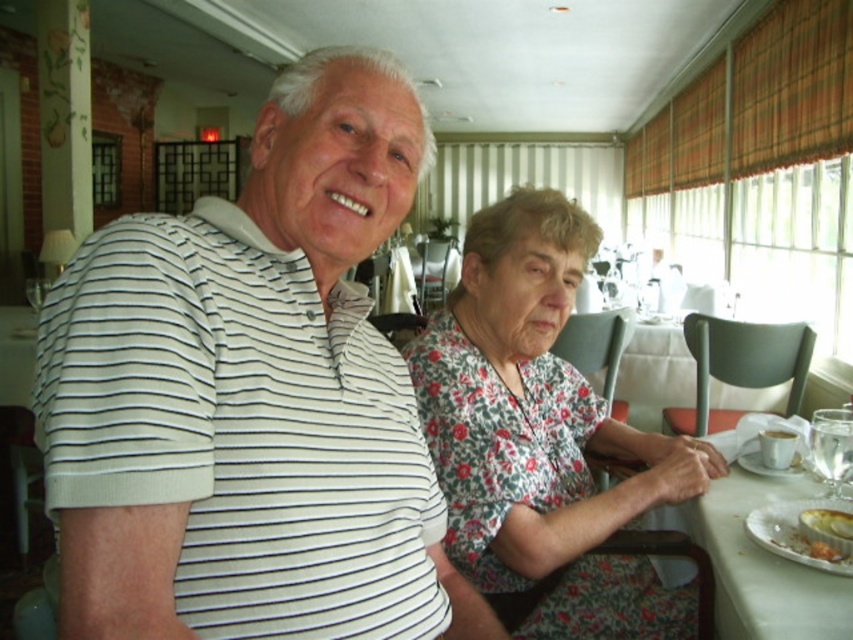
Is point (253, 451) positioned behind point (751, 532)?

No.

Does white striped polo shirt at left have a lesser height compared to white porcelain plate at lower right?

In fact, white striped polo shirt at left may be taller than white porcelain plate at lower right.

Find the location of `white striped polo shirt at left`. white striped polo shirt at left is located at coordinates (251, 397).

Does floral fabric dress at center appear on the left side of white porcelain plate at lower right?

Indeed, floral fabric dress at center is positioned on the left side of white porcelain plate at lower right.

How far apart are floral fabric dress at center and white porcelain plate at lower right?

floral fabric dress at center is 14.32 inches from white porcelain plate at lower right.

Which is in front, point (479, 472) or point (792, 534)?

Point (792, 534) is more forward.

In order to click on floral fabric dress at center in this screenshot , I will do `click(543, 435)`.

The image size is (853, 640). What do you see at coordinates (251, 397) in the screenshot?
I see `white striped polo shirt at left` at bounding box center [251, 397].

Between white striped polo shirt at left and white cloth table at lower right, which one appears on the left side from the viewer's perspective?

white striped polo shirt at left is more to the left.

Image resolution: width=853 pixels, height=640 pixels. What do you see at coordinates (251, 397) in the screenshot? I see `white striped polo shirt at left` at bounding box center [251, 397].

Where is `white striped polo shirt at left`? white striped polo shirt at left is located at coordinates (251, 397).